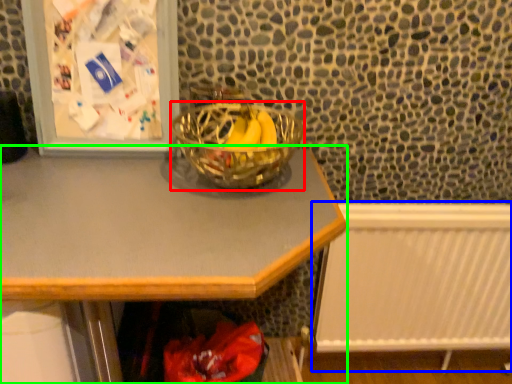
Question: Which object is positioned closest to glass bowl (highlighted by a red box)? Select from radiator (highlighted by a blue box) and desk (highlighted by a green box).

Choices:
 (A) radiator
 (B) desk

Answer: (B)